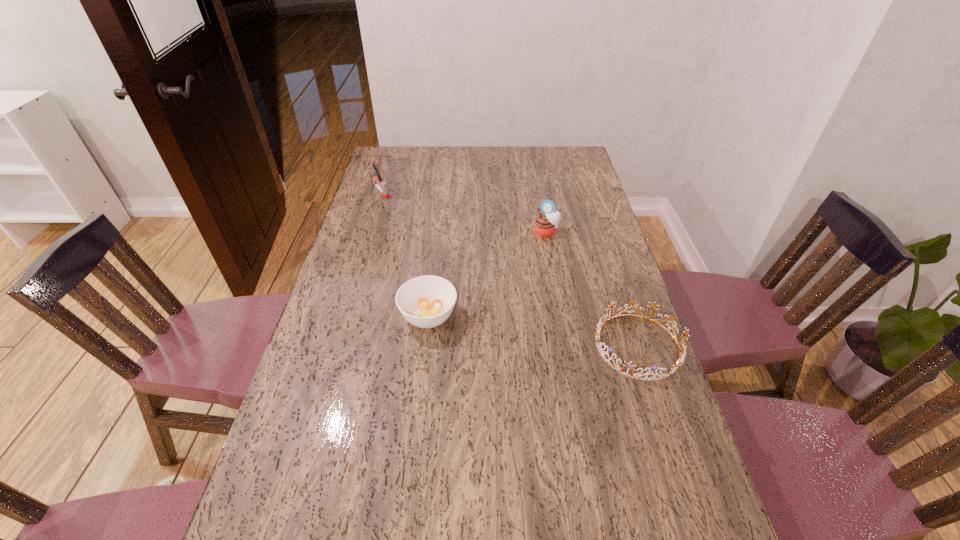
The image size is (960, 540). In the image, there is a desktop. What are the coordinates of `vacant space at the right edge` in the screenshot? It's located at coord(591,245).

You are a GUI agent. You are given a task and a screenshot of the screen. Output one action in this format:
    pyautogui.click(x=<x>, y=<y>)
    Task: Click on the vacant space at the far left corner
    The width and height of the screenshot is (960, 540).
    Given the screenshot: What is the action you would take?
    pyautogui.click(x=381, y=159)

The height and width of the screenshot is (540, 960). In order to click on vacant region at the near left corner of the desktop in this screenshot , I will do `click(327, 526)`.

Find the location of a particular element. This screenshot has height=540, width=960. vacant space at the near right corner of the desktop is located at coordinates (683, 495).

Locate an element on the screen. The width and height of the screenshot is (960, 540). vacant area that lies between the soup bowl and the muffin is located at coordinates (488, 274).

The width and height of the screenshot is (960, 540). Identify the location of free area in between the rightmost object and the second object from right to left. 591,288.

The height and width of the screenshot is (540, 960). In order to click on free area in between the second tallest object and the tiara in this screenshot , I will do `click(509, 268)`.

I want to click on vacant area between the leftmost object and the second object from left to right, so click(x=405, y=253).

Where is `empty space that is in between the tiara and the farthest object`? This screenshot has width=960, height=540. empty space that is in between the tiara and the farthest object is located at coordinates (509, 268).

Image resolution: width=960 pixels, height=540 pixels. What are the coordinates of `empty space between the tiara and the leftmost object` in the screenshot? It's located at [509, 268].